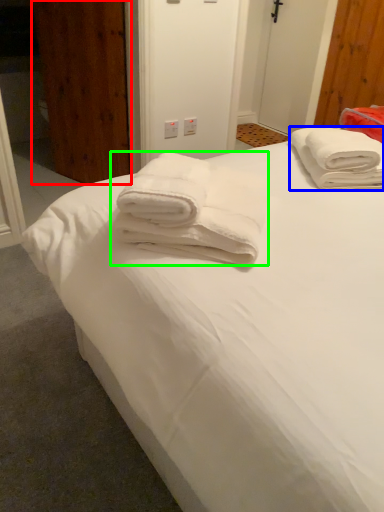
Question: Which is farther away from door (highlighted by a red box)? towel (highlighted by a blue box) or towel (highlighted by a green box)?

Choices:
 (A) towel
 (B) towel

Answer: (B)